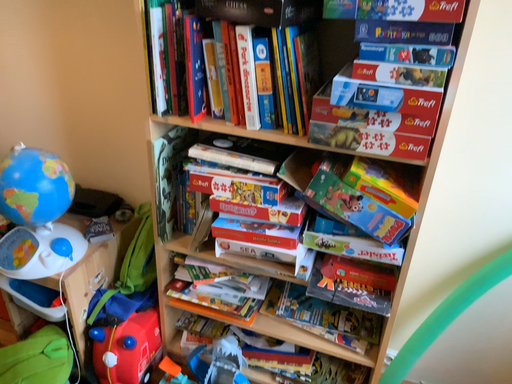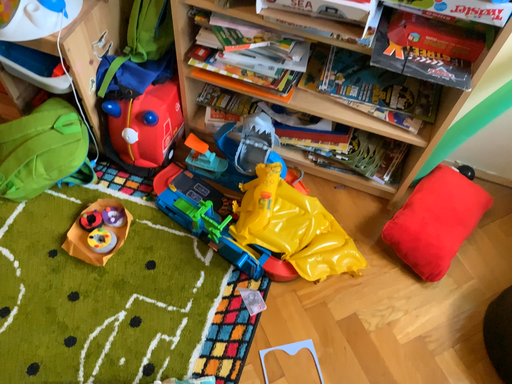
Question: How did the camera likely rotate when shooting the video?

Choices:
 (A) rotated downward
 (B) rotated upward

Answer: (A)